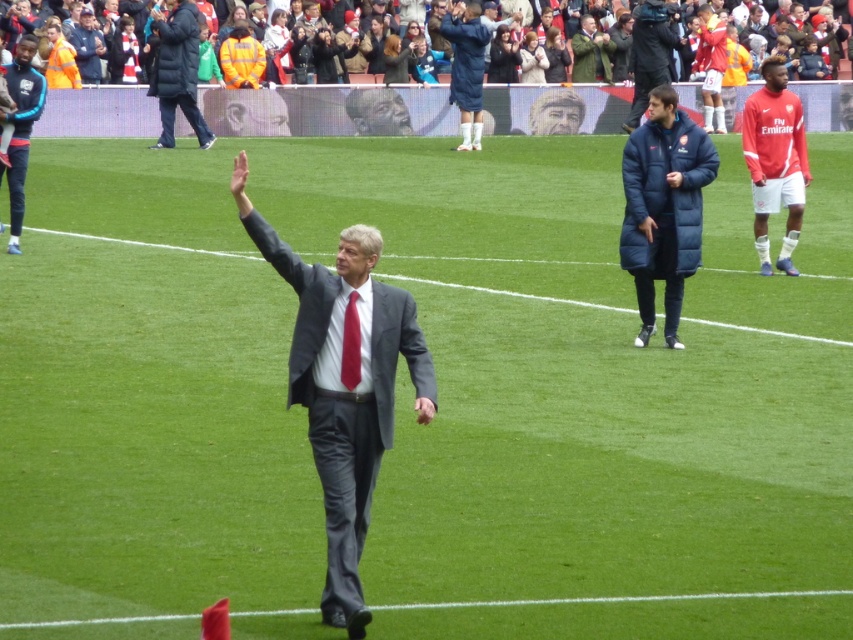
Question: Does navy blue puffer coat at center have a smaller size compared to red jersey at right?

Choices:
 (A) no
 (B) yes

Answer: (A)

Question: Is the position of navy blue puffer coat at center less distant than that of dark blue padded jacket at upper left?

Choices:
 (A) no
 (B) yes

Answer: (B)

Question: Among these points, which one is farthest from the camera?

Choices:
 (A) (68, 36)
 (B) (462, 83)

Answer: (A)

Question: Which object appears farthest from the camera in this image?

Choices:
 (A) blue synthetic jacket at left
 (B) dark blue wool coat at center
 (C) red fabric crowd at upper center
 (D) navy blue puffer coat at center

Answer: (B)

Question: Is dark blue puffer jacket at upper left below green artificial turf at lower center?

Choices:
 (A) yes
 (B) no

Answer: (B)

Question: Among these objects, which one is nearest to the camera?

Choices:
 (A) smooth gray suit at center
 (B) dark blue puffer jacket at upper left
 (C) dark blue wool coat at center
 (D) red fabric crowd at upper center

Answer: (B)